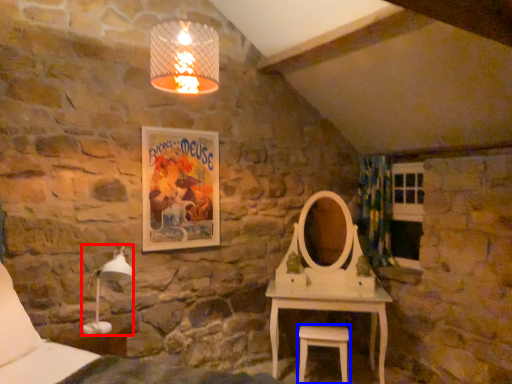
Question: Which of the following is the farthest to the observer, table lamp (highlighted by a red box) or stool (highlighted by a blue box)?

Choices:
 (A) table lamp
 (B) stool

Answer: (B)